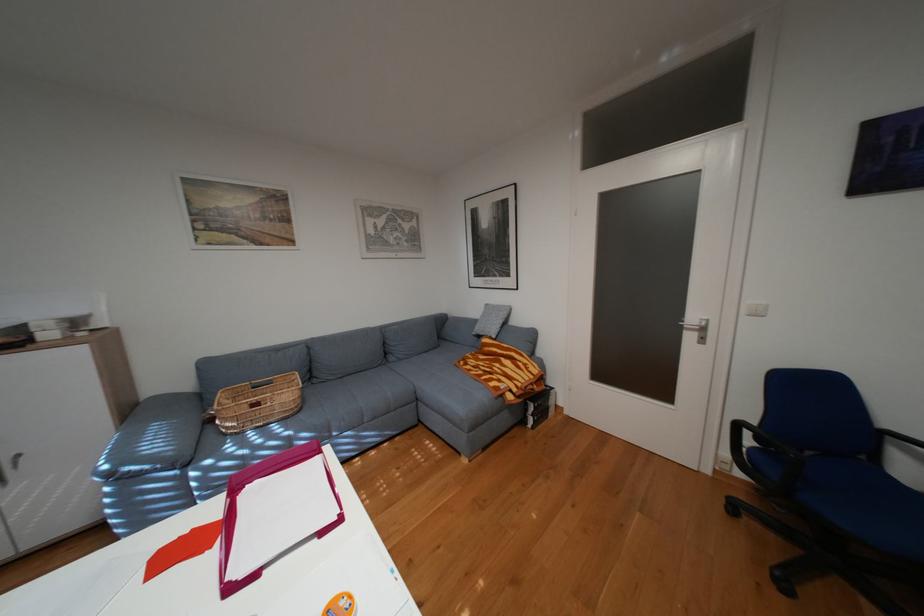
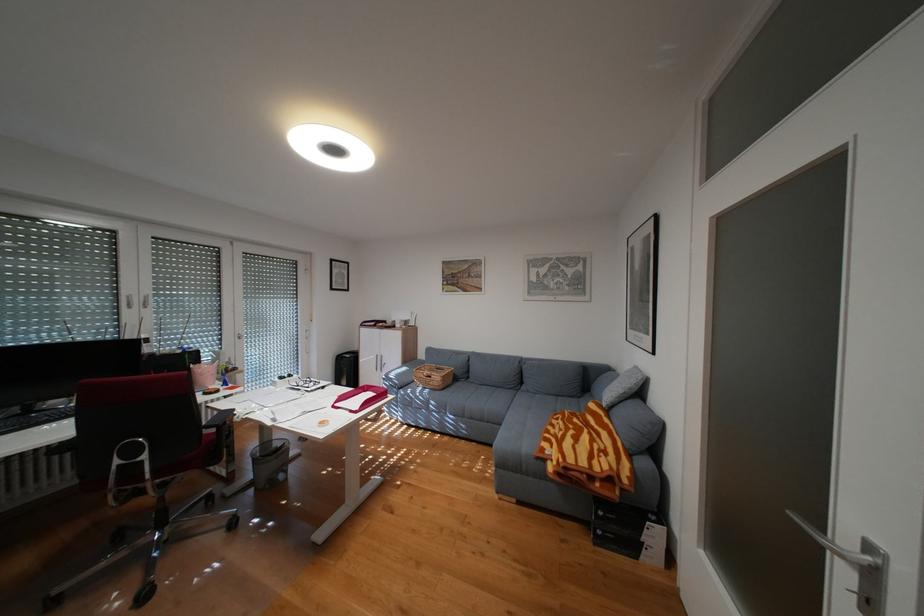
Where in the second image is the point corresponding to [298,395] from the first image?

(450, 377)